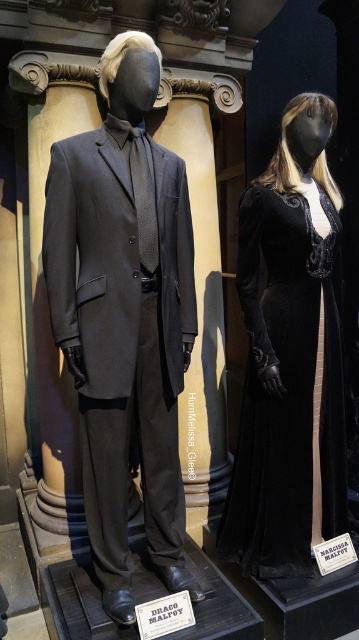
Question: Is the position of matte black suit at center more distant than that of velvet black dress at right?

Choices:
 (A) yes
 (B) no

Answer: (B)

Question: Which point is farther from the camera taking this photo?

Choices:
 (A) (128, 417)
 (B) (332, 492)

Answer: (B)

Question: Observing the image, what is the correct spatial positioning of matte black suit at center in reference to velvet black dress at right?

Choices:
 (A) left
 (B) right

Answer: (A)

Question: Is matte black suit at center bigger than velvet black dress at right?

Choices:
 (A) yes
 (B) no

Answer: (A)